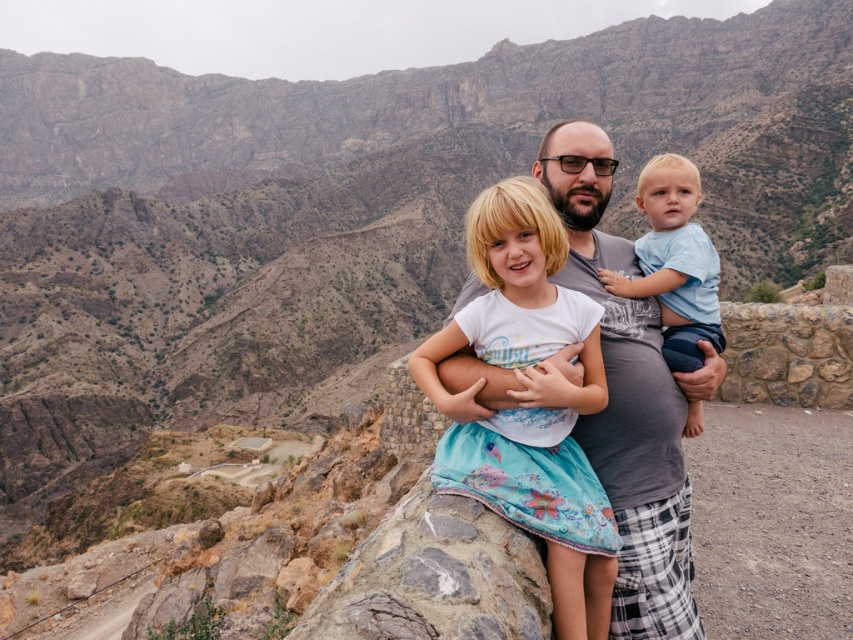
Is white cotton dress at center above light blue cotton shirt at center?

No.

Image resolution: width=853 pixels, height=640 pixels. Describe the element at coordinates (527, 401) in the screenshot. I see `white cotton dress at center` at that location.

I want to click on white cotton dress at center, so click(527, 401).